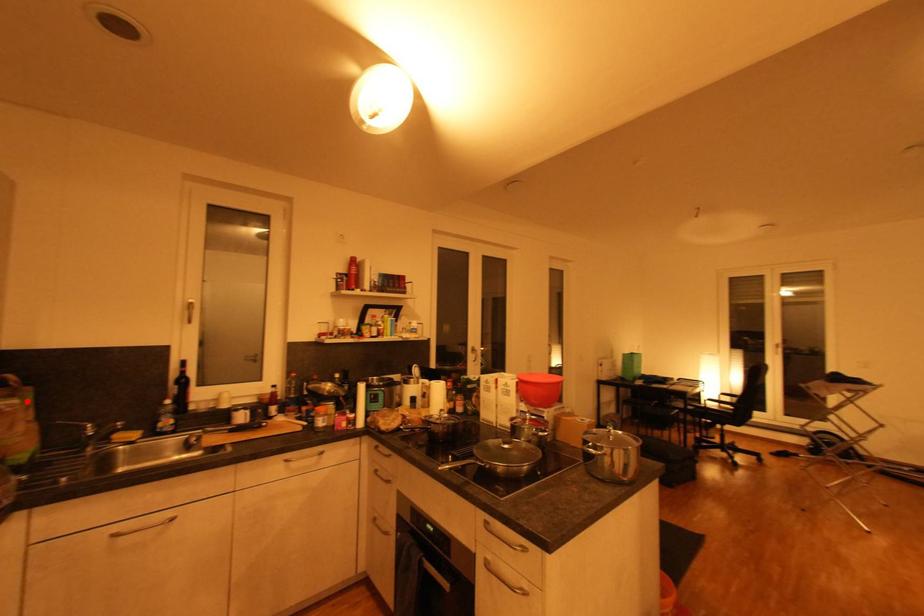
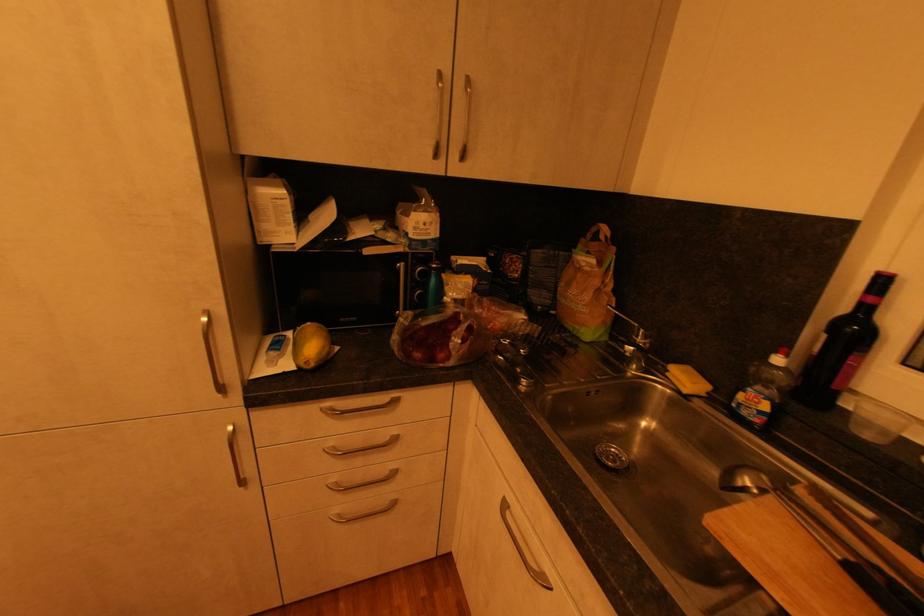
Where in the second image is the point corresponding to the highlighted location from the first image?

(604, 264)